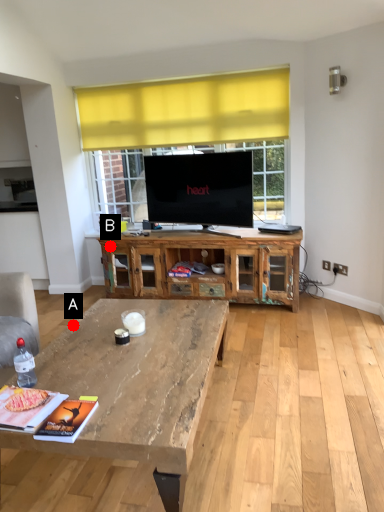
Question: Two points are circled on the image, labeled by A and B beside each circle. Which of the following is the closest to the observer?

Choices:
 (A) A is closer
 (B) B is closer

Answer: (A)